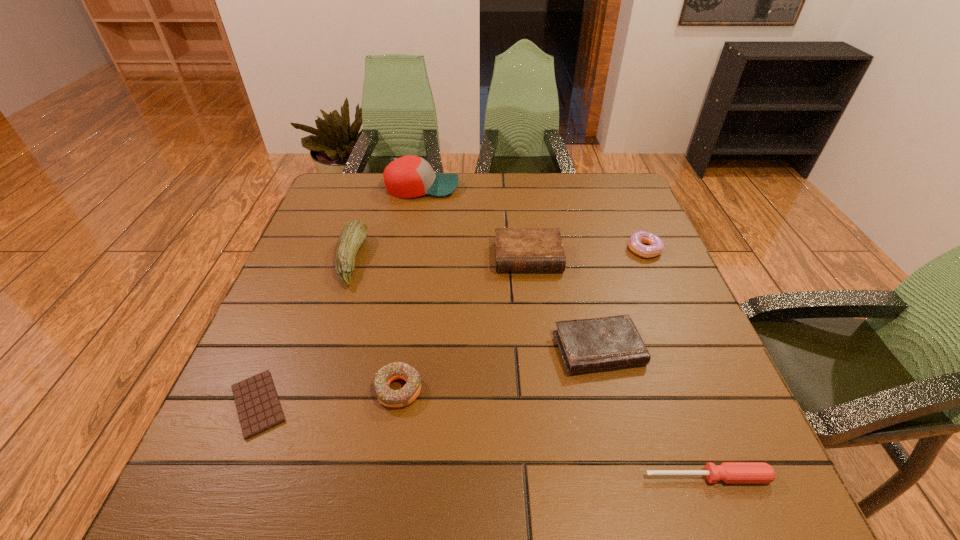
This screenshot has width=960, height=540. In the image, there is a desktop. Find the location of `vacant space at the right edge`. vacant space at the right edge is located at coordinates (605, 264).

Locate an element on the screen. vacant area at the far left corner is located at coordinates (352, 211).

The height and width of the screenshot is (540, 960). I want to click on vacant region between the farther diary and the nearer doughnut, so click(x=464, y=323).

Image resolution: width=960 pixels, height=540 pixels. In order to click on free space between the chocolate bar and the left doughnut in this screenshot , I will do coord(328,396).

The height and width of the screenshot is (540, 960). In order to click on blank region between the shorter diary and the zucchini in this screenshot , I will do `click(475, 304)`.

You are a GUI agent. You are given a task and a screenshot of the screen. Output one action in this format:
    pyautogui.click(x=<x>, y=<y>)
    Task: Click on the vacant space in between the zucchini and the farthest object
    This screenshot has height=540, width=960.
    Given the screenshot: What is the action you would take?
    pyautogui.click(x=387, y=223)

I want to click on blank region between the chocolate bar and the farthest object, so click(x=340, y=295).

Where is `free space between the nearer doughnut and the seventh shortest object`? free space between the nearer doughnut and the seventh shortest object is located at coordinates (375, 325).

You are a GUI agent. You are given a task and a screenshot of the screen. Output one action in this format:
    pyautogui.click(x=<x>, y=<y>)
    Task: Click on the vacant area that lies between the nearer diary and the left doughnut
    Image resolution: width=960 pixels, height=540 pixels.
    Given the screenshot: What is the action you would take?
    pyautogui.click(x=498, y=369)

This screenshot has height=540, width=960. I want to click on object that is the fourth closest one to the seventh shortest object, so click(x=516, y=249).